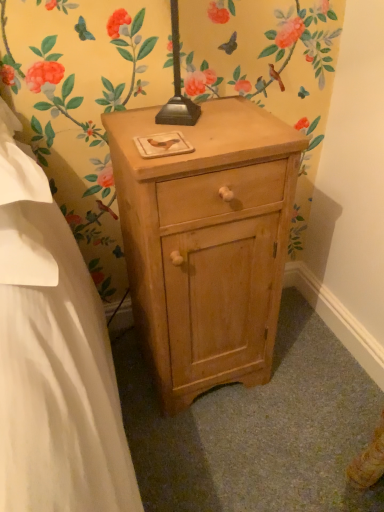
Where is `empty space that is ontop of natural wood nightstand at center (from a real-world perspective)`? empty space that is ontop of natural wood nightstand at center (from a real-world perspective) is located at coordinates (198, 126).